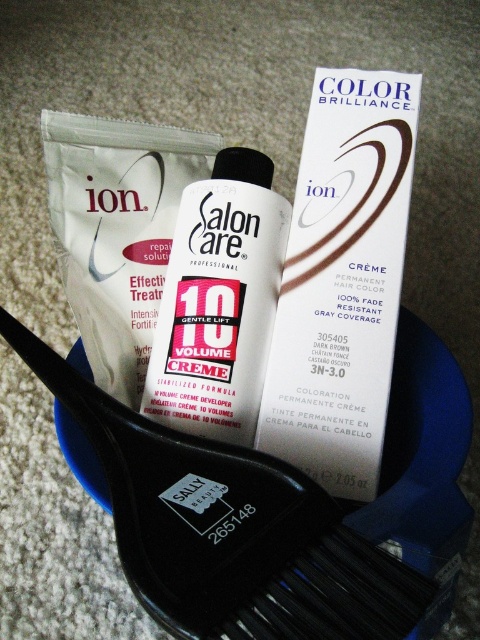
Is black plastic brush at center thinner than dark brown cream at upper right?

No, black plastic brush at center is not thinner than dark brown cream at upper right.

Between point (375, 556) and point (381, 340), which one is positioned behind?

The point (381, 340) is more distant.

Locate an element on the screen. black plastic brush at center is located at coordinates (228, 529).

Looking at this image, who is positioned more to the left, black plastic brush at center or white glossy bottle at center?

black plastic brush at center is more to the left.

What do you see at coordinates (228, 529) in the screenshot?
I see `black plastic brush at center` at bounding box center [228, 529].

Locate an element on the screen. The width and height of the screenshot is (480, 640). black plastic brush at center is located at coordinates tap(228, 529).

Does dark brown cream at upper right have a smaller size compared to white glossy bottle at center?

Incorrect, dark brown cream at upper right is not smaller in size than white glossy bottle at center.

You are a GUI agent. You are given a task and a screenshot of the screen. Output one action in this format:
    pyautogui.click(x=<x>, y=<y>)
    Task: Click on the dark brown cream at upper right
    Image resolution: width=480 pixels, height=640 pixels.
    Given the screenshot: What is the action you would take?
    342,280

Which is in front, point (298, 464) or point (162, 380)?

Point (298, 464) is more forward.

At what (x,y) coordinates should I click in order to perform the action: click on dark brown cream at upper right. Please return your answer as a coordinate pair (x, y). Image resolution: width=480 pixels, height=640 pixels. Looking at the image, I should click on (342, 280).